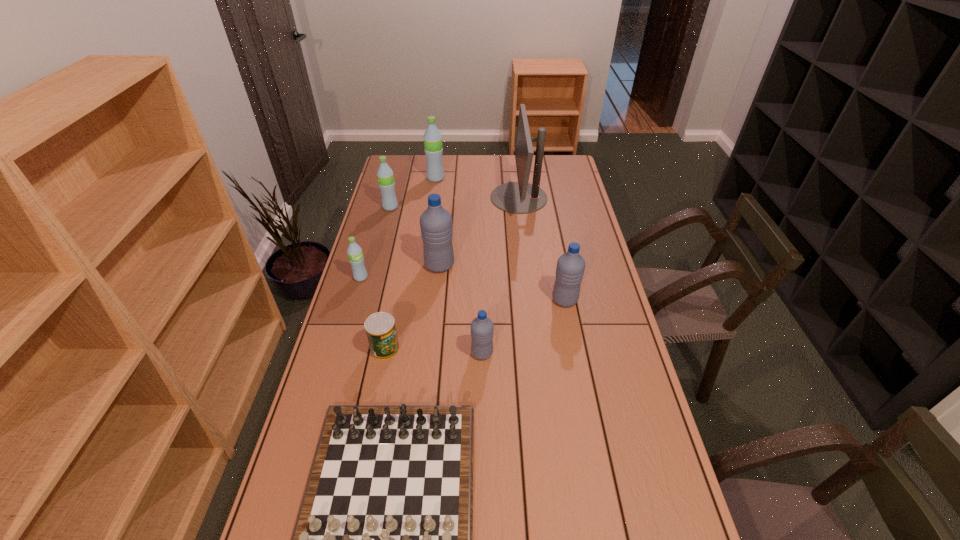
The height and width of the screenshot is (540, 960). What are the coordinates of `green water bottle that stands as the closest to the shortest object` in the screenshot? It's located at (356, 259).

Find the location of a particular element. This screenshot has height=540, width=960. the second closest green water bottle to the second farthest green water bottle is located at coordinates (356, 259).

Identify which blue water bottle is the nearest to the can. Please provide its 2D coordinates. Your answer should be formatted as a tuple, i.e. [(x, y)], where the tuple contains the x and y coordinates of a point satisfying the conditions above.

[(482, 328)]

This screenshot has height=540, width=960. What are the coordinates of `blue water bottle that is the second closest to the second blue water bottle from right to left` in the screenshot? It's located at (436, 226).

You are a GUI agent. You are given a task and a screenshot of the screen. Output one action in this format:
    pyautogui.click(x=<x>, y=<y>)
    Task: Click on the free region that satisfies the following two spatial constraints: 1. on the front side of the eighth tallest object; 2. on the right side of the smallest green water bottle
    Image resolution: width=960 pixels, height=540 pixels.
    Given the screenshot: What is the action you would take?
    pyautogui.click(x=341, y=348)

This screenshot has width=960, height=540. What are the coordinates of `free spot that satisfies the following two spatial constraints: 1. on the front side of the smallest green water bottle; 2. on the right side of the nearest water bottle` in the screenshot? It's located at (339, 353).

This screenshot has width=960, height=540. In order to click on vacant space that satisfies the following two spatial constraints: 1. on the screen of the gray computer monitor; 2. on the back side of the second nearest water bottle in this screenshot , I will do `click(531, 300)`.